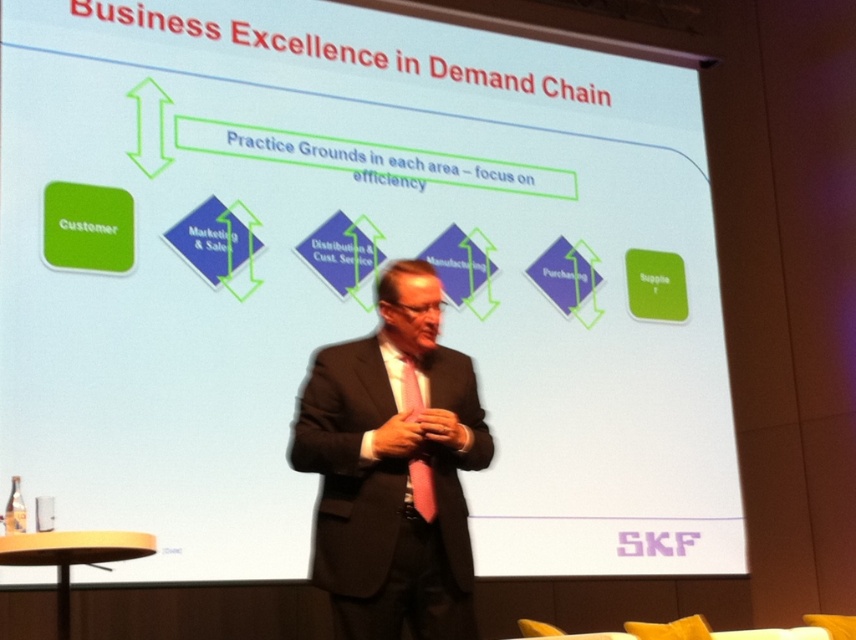
Question: Which of the following is the closest to the observer?

Choices:
 (A) matte black suit at center
 (B) pink satin tie at center

Answer: (A)

Question: Is matte black suit at center behind pink satin tie at center?

Choices:
 (A) yes
 (B) no

Answer: (B)

Question: Among these objects, which one is farthest from the camera?

Choices:
 (A) matte black suit at center
 (B) pink satin tie at center

Answer: (B)

Question: Does matte black suit at center appear over pink satin tie at center?

Choices:
 (A) yes
 (B) no

Answer: (B)

Question: Is the position of matte black suit at center less distant than that of pink satin tie at center?

Choices:
 (A) no
 (B) yes

Answer: (B)